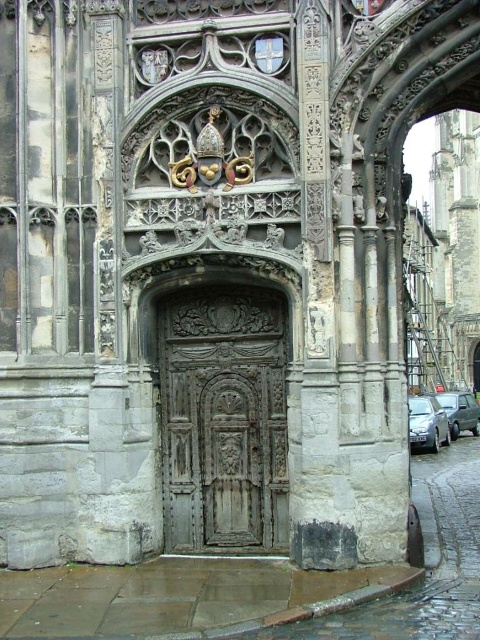
You are a delivery driver with a 10 feet long truck. You need to park your truck between the rusty metal door at center and the silver metallic car at lower right. Is there enough space to park your truck without overlapping either object?

The rusty metal door at center and silver metallic car at lower right are 57.09 feet apart from each other. Since your truck is only 10 feet long, there is sufficient space to park between them without overlapping either object.

You are a delivery driver who needs to enter the historic building through the rusty metal door at center. Your metallic silver van at lower right is 2 meters tall. Can your van pass through the doorway without any issues?

The rusty metal door at center has a greater height compared to metallic silver van at lower right, so the van can pass through as the door is taller than the van.

Based on the photo, you are a delivery driver who needs to enter the historic building through the doorway. Your silver metallic car at lower right is 2 meters wide. Can the rusty metal door at center, which is narrower, accommodate your vehicle?

The rusty metal door at center has a lesser width compared to the silver metallic car at lower right. Therefore, the door is too narrow to allow the car to pass through safely.